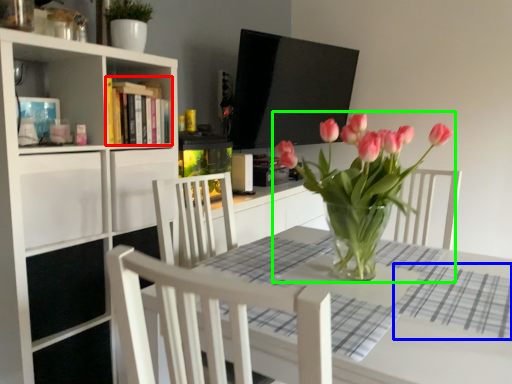
Question: Which object is the farthest from book (highlighted by a red box)? Choose among these: plaid (highlighted by a blue box) or houseplant (highlighted by a green box).

Choices:
 (A) plaid
 (B) houseplant

Answer: (A)